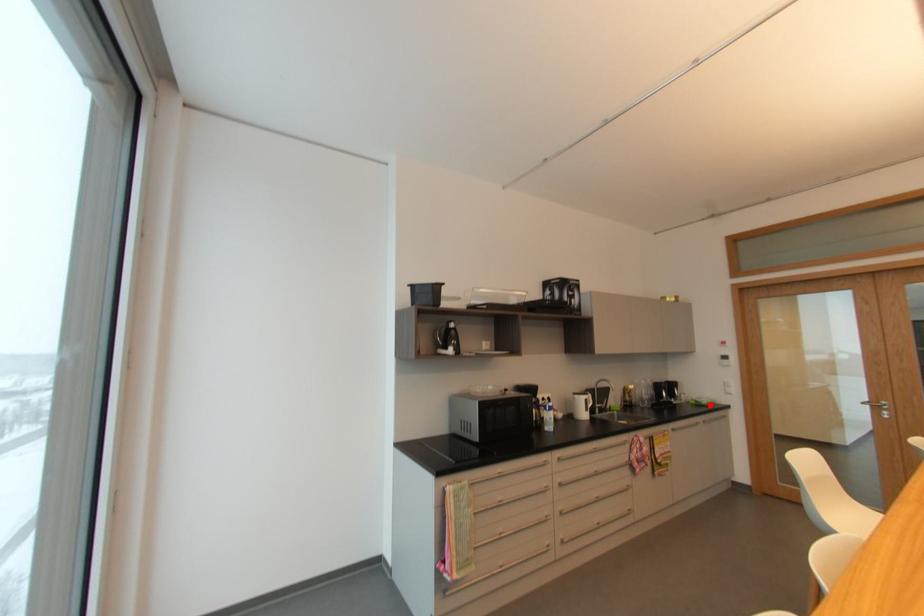
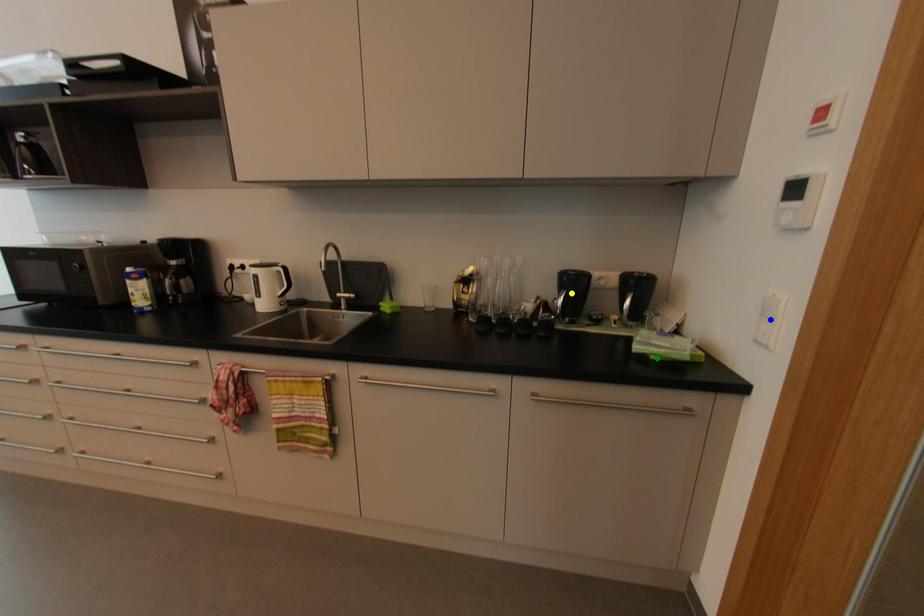
Question: I am providing you with two images of the same scene from different viewpoints. A red point is marked on the first image. You are given multiple points on the second image. Which point in image 2 is actually the same real-world point as the red point in image 1?

Choices:
 (A) green point
 (B) blue point
 (C) yellow point

Answer: (A)